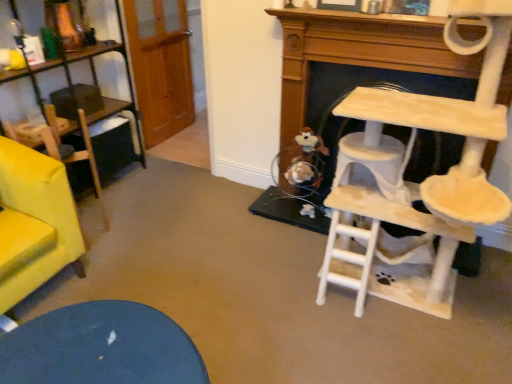
Question: From a real-world perspective, is beige wooden cat tree at right positioned above or below beige felt cat tree at right?

Choices:
 (A) above
 (B) below

Answer: (A)

Question: Considering the relative positions of beige wooden cat tree at right and beige felt cat tree at right in the image provided, is beige wooden cat tree at right to the left or to the right of beige felt cat tree at right?

Choices:
 (A) right
 (B) left

Answer: (B)

Question: Estimate the real-world distances between objects in this image. Which object is farther from the brown plush toy at lower center?

Choices:
 (A) beige wooden cat tree at right
 (B) beige felt cat tree at right
 (C) velvet yellow armchair at left

Answer: (C)

Question: Which of these objects is positioned farthest from the brown plush toy at lower center?

Choices:
 (A) beige wooden cat tree at right
 (B) velvet yellow armchair at left
 (C) beige felt cat tree at right

Answer: (B)